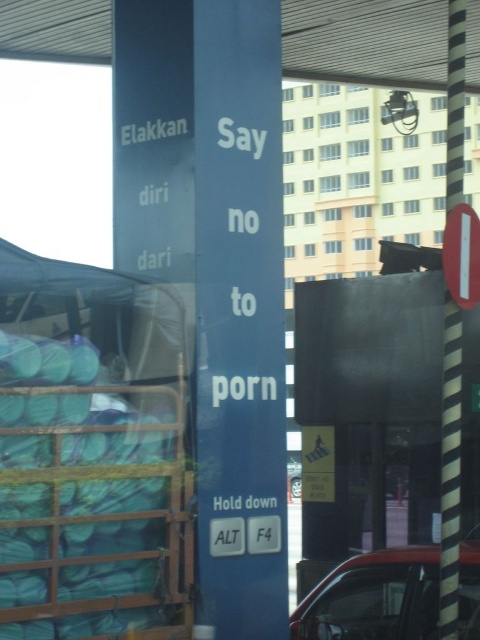
You are a delivery person who needs to park your vehicle at the lower right corner of the image. There is a point marked at coordinate [373,596]. What object is located at that point?

The point at coordinate [373,596] marks the red glossy car at lower right.

You are a pedestrian standing in front of the blue pillar. You want to cross the street to reach the red glossy car at lower right and the metallic silver car at center. Which car should you cross towards first if you want to go to the one further to the right?

You should cross towards the red glossy car at lower right first because it is positioned to the right of the metallic silver car at center, making it further to the right.

You are a delivery person needing to park your 1.6 meter long motorcycle between the red glossy car at lower right and the metallic silver car at center. Can you fit your motorcycle there?

The distance between the red glossy car at lower right and the metallic silver car at center is 1.59 meters, which is slightly shorter than your motorcycle length of 1.6 meters. Therefore, you cannot fit your motorcycle there.